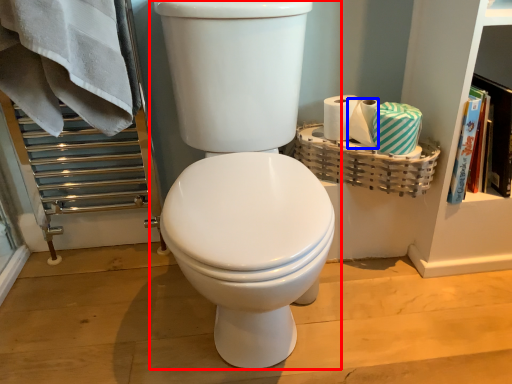
Question: Among these objects, which one is nearest to the camera, toilet (highlighted by a red box) or toilet paper (highlighted by a blue box)?

Choices:
 (A) toilet
 (B) toilet paper

Answer: (A)